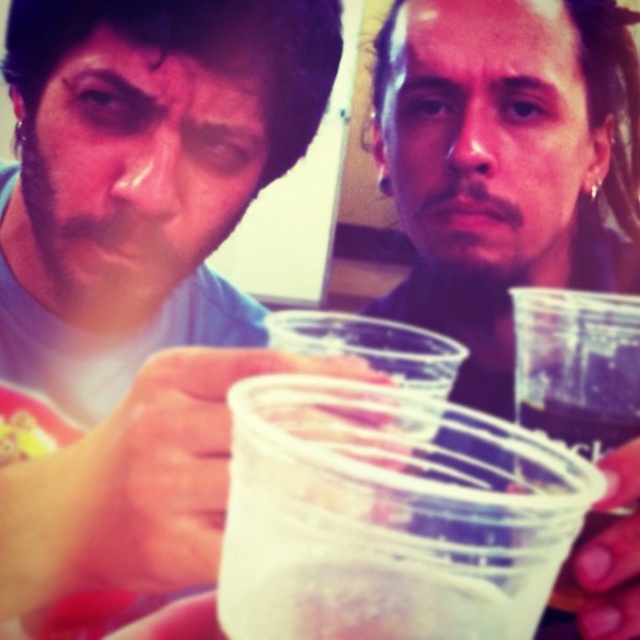
You are a photographer standing at the point marked by the coordinate point at point (403,598). You want to take a photo of the two people. The photographer needs to ensure that both subjects are in focus. Given that the depth of field can cover 9 inches, will both people be in focus?

The two people are 8.97 inches apart, which is within the 9 inch depth of field, so both will be in focus.

You are at a party and need to pour a drink into the translucent plastic cup at center and the clear plastic cup at center. Which cup requires more liquid to fill completely?

The translucent plastic cup at center is bigger than the clear plastic cup at center, so it requires more liquid to fill completely.

You are standing at the origin point in a coordinate system where the image is represented as a 2D plane. The translucent plastic cup at center is located at coordinates 0.805, 0.609. If you want to move directly towards the cup, which direction should you head in?

To move directly towards the translucent plastic cup at center located at coordinates (388, 515) from the origin, you should head in the direction of increasing both the x and y coordinates since the cup is in the positive quadrant relative to the origin.